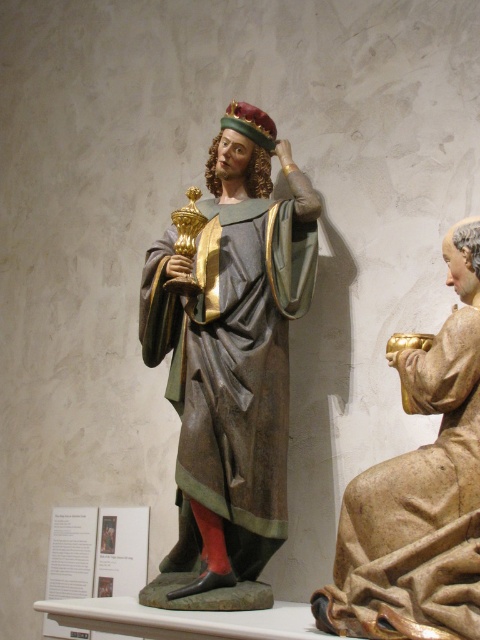
Please provide the exact coordinates of the polychrome wood statue at center in the image.

The polychrome wood statue at center is located at coordinates point (x=232, y=349).

You are an art conservator assessing the display of the polychrome wood statue at center and the wooden cup at right. Given their sizes, which object would require a more stable base to prevent tipping over?

The polychrome wood statue at center has a larger size compared to the wooden cup at right, so it would require a more stable base to prevent tipping over due to its greater mass and height.

You are an art conservator examining the two statues in the image. You need to move the polychrome wood statue at center and the wooden cup at right to a new display area. If you want to maintain their original spatial relationship, which object should you place first in the new location?

The polychrome wood statue at center should be placed first in the new location because it is positioned on the left side of the wooden cup at right, so placing it first allows you to position the wooden cup at right to its right side while maintaining their original spatial relationship.